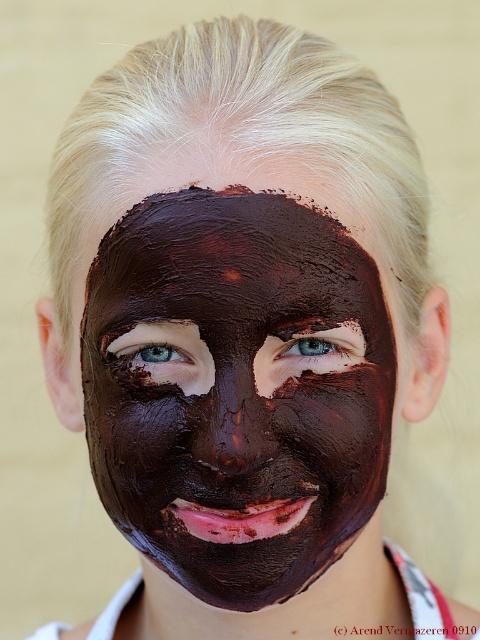
You are a skincare specialist examining the image of a person with a matte chocolate mask at center and a brown matte eye at center. Based on the description, which object occupies more vertical space in the image?

The matte chocolate mask at center has a greater height compared to the brown matte eye at center, so it occupies more vertical space in the image.

You are a makeup artist trying to apply a matte chocolate mask at center and a blue matte eye at center. Which object should you place first to avoid covering the other?

The blue matte eye at center should be placed first before applying the matte chocolate mask at center since the mask is on the right side of the eye, and applying the mask afterward would cover part of the eye.

You are a skincare assistant and need to apply a matte chocolate mask at center to a client. The client has a face that is 20 cm wide. The mask currently covers an area from the forehead to the chin. Is the width of the mask sufficient to cover the entire face?

The matte chocolate mask at center is located at point coordinates, but the description does not provide the width of the mask. Therefore, it is impossible to determine if the mask is wide enough to cover the entire 20 cm face.